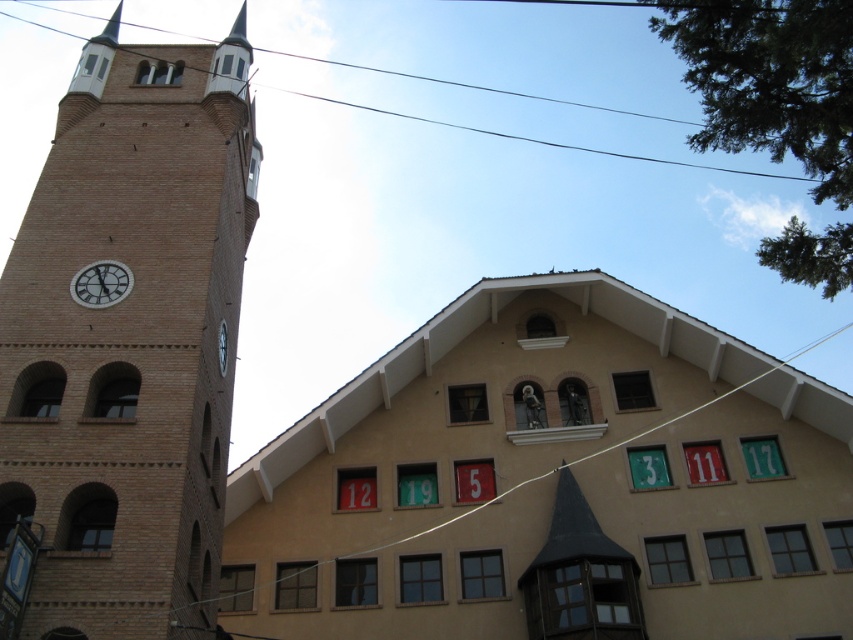
You are an architect examining the building. You notice the brick tower at left and the black wire at upper center. Which structure is higher in elevation?

The brick tower at left is taller than the black wire at upper center, so the brick tower at left is higher in elevation.

You are standing in front of the two story building and want to determine which point is closer to you. The points are point (x=456, y=125) and point (x=219, y=346). Which point is closer to you?

Point (x=456, y=125) is further to the viewer than point (x=219, y=346), so the point closer to you is point (x=219, y=346).